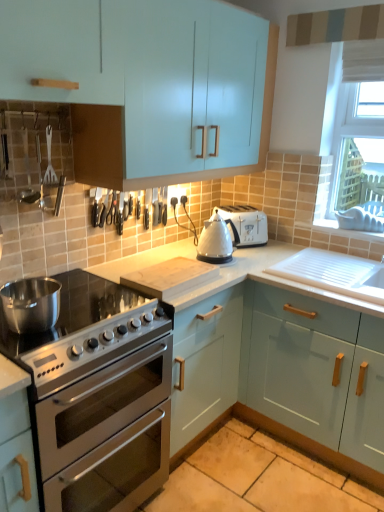
What are the coordinates of `free space above light blue matte cabinet at lower right, the first cabinetry when ordered from bottom to top (from a real-world perspective)` in the screenshot? It's located at (320, 273).